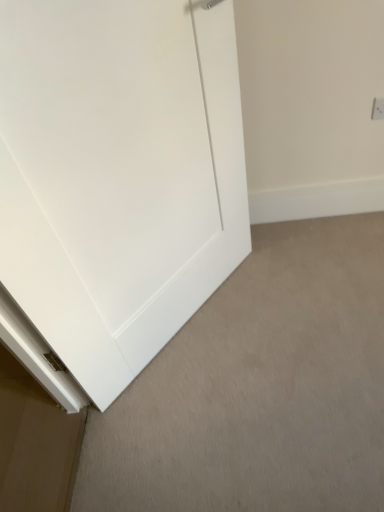
Question: From the image's perspective, is white plastic electric outlet at upper right on top of white matte door at center?

Choices:
 (A) no
 (B) yes

Answer: (B)

Question: Considering the relative sizes of white plastic electric outlet at upper right and white matte door at center in the image provided, is white plastic electric outlet at upper right smaller than white matte door at center?

Choices:
 (A) yes
 (B) no

Answer: (A)

Question: Is white plastic electric outlet at upper right positioned before white matte door at center?

Choices:
 (A) no
 (B) yes

Answer: (A)

Question: Considering the relative sizes of white plastic electric outlet at upper right and white matte door at center in the image provided, is white plastic electric outlet at upper right shorter than white matte door at center?

Choices:
 (A) yes
 (B) no

Answer: (A)

Question: Is white plastic electric outlet at upper right not close to white matte door at center?

Choices:
 (A) yes
 (B) no

Answer: (B)

Question: From the image's perspective, is white matte door at center above or below white plastic electric outlet at upper right?

Choices:
 (A) above
 (B) below

Answer: (B)

Question: Is point (190, 249) positioned closer to the camera than point (375, 113)?

Choices:
 (A) farther
 (B) closer

Answer: (B)

Question: Is white matte door at center inside the boundaries of white plastic electric outlet at upper right, or outside?

Choices:
 (A) inside
 (B) outside

Answer: (B)

Question: Relative to white plastic electric outlet at upper right, is white matte door at center in front or behind?

Choices:
 (A) behind
 (B) front

Answer: (B)

Question: From the image's perspective, is white plastic electric outlet at upper right located above or below white matte baseboard at lower left?

Choices:
 (A) above
 (B) below

Answer: (A)

Question: Considering the relative positions of white plastic electric outlet at upper right and white matte baseboard at lower left in the image provided, is white plastic electric outlet at upper right to the left or to the right of white matte baseboard at lower left?

Choices:
 (A) left
 (B) right

Answer: (B)

Question: Is white plastic electric outlet at upper right taller or shorter than white matte baseboard at lower left?

Choices:
 (A) tall
 (B) short

Answer: (A)

Question: In terms of size, does white plastic electric outlet at upper right appear bigger or smaller than white matte baseboard at lower left?

Choices:
 (A) small
 (B) big

Answer: (A)

Question: Is white plastic electric outlet at upper right in front of or behind white matte door at center in the image?

Choices:
 (A) behind
 (B) front

Answer: (A)

Question: Considering the positions of white plastic electric outlet at upper right and white matte door at center in the image, is white plastic electric outlet at upper right taller or shorter than white matte door at center?

Choices:
 (A) tall
 (B) short

Answer: (B)